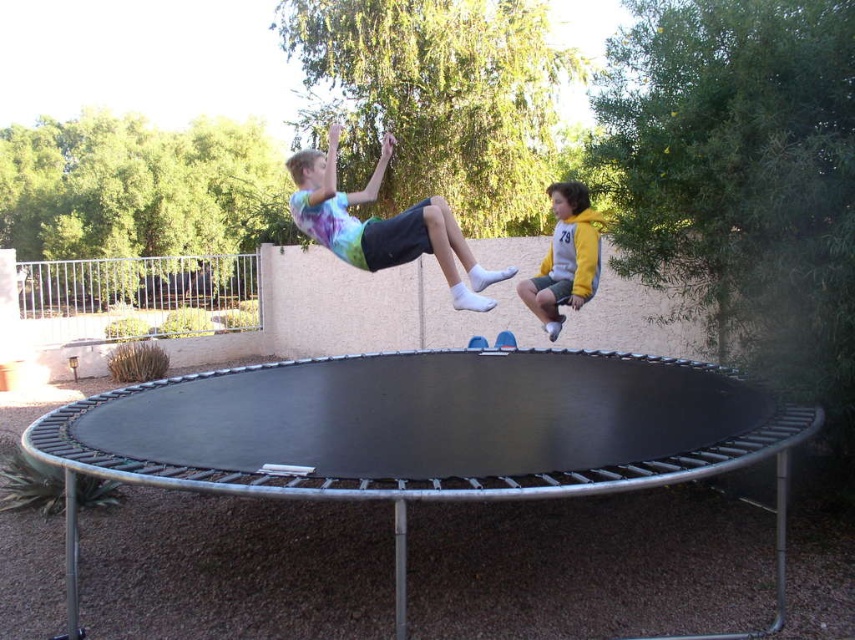
Question: Which point is farther from the camera taking this photo?

Choices:
 (A) (517, 285)
 (B) (388, 136)

Answer: (A)

Question: Which of the following is the farthest from the observer?

Choices:
 (A) tie-dye fabric shirt at upper center
 (B) yellow fleece jacket at upper right

Answer: (B)

Question: From the image, what is the correct spatial relationship of tie-dye fabric shirt at upper center in relation to yellow fleece jacket at upper right?

Choices:
 (A) above
 (B) below

Answer: (A)

Question: Which point is closer to the camera?

Choices:
 (A) tie-dye fabric shirt at upper center
 (B) yellow fleece jacket at upper right

Answer: (A)

Question: Is tie-dye fabric shirt at upper center in front of yellow fleece jacket at upper right?

Choices:
 (A) no
 (B) yes

Answer: (B)

Question: Is tie-dye fabric shirt at upper center thinner than yellow fleece jacket at upper right?

Choices:
 (A) no
 (B) yes

Answer: (A)